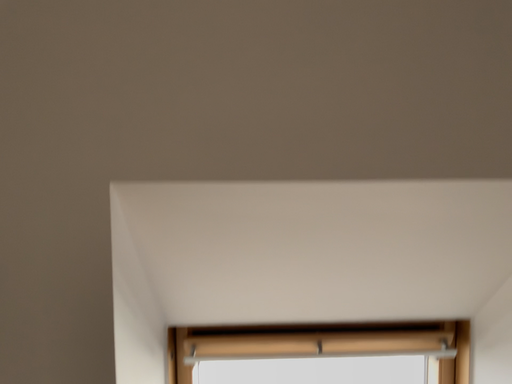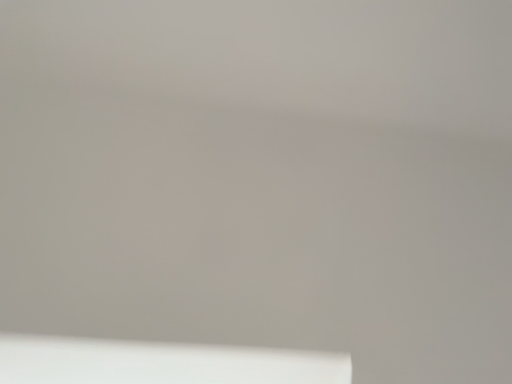
Question: How did the camera likely rotate when shooting the video?

Choices:
 (A) rotated downward
 (B) rotated upward

Answer: (B)